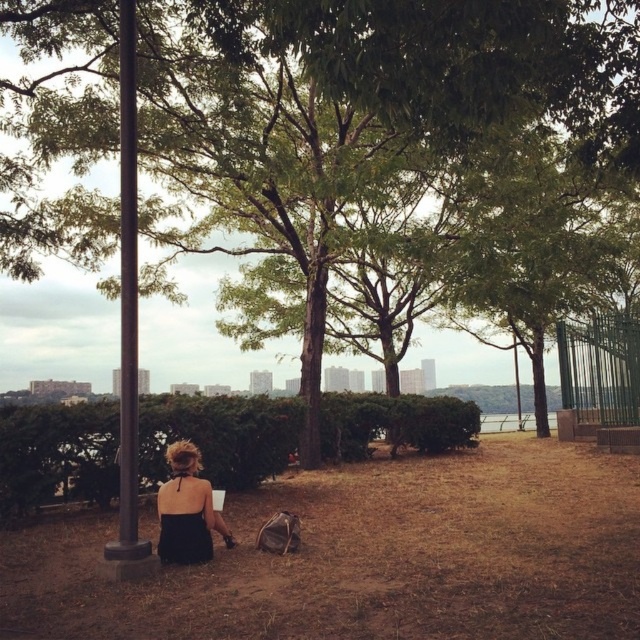
You are a photographer setting up equipment in the park. You need to position a tripod between the black metal pole at left and the black satin dress at lower left. According to the scene, where should you place the tripod?

The black metal pole at left is to the left of the black satin dress at lower left, so you should place the tripod between them, ensuring it is positioned to the right of the black metal pole at left and to the left of the black satin dress at lower left.

You are a photographer setting up equipment in the park. You notice the black metal pole at left and the black satin dress at lower left. Which object should you avoid placing your tripod near to ensure it doesn t block the view of the trees in the midground?

You should avoid placing your tripod near the black metal pole at left because it is larger in size than the black satin dress at lower left, so it is more likely to obstruct the view of the trees in the midground.

You are a photographer setting up a shot of the scene. You have a camera with a lens that can focus on objects up to 1 meter in width. You need to decide whether the black metal pole at left and the black satin dress at lower left will both fit within the frame. The frame can only accommodate objects with a combined width of 1.5 meters. What should you do?

The black metal pole at left is thinner than the black satin dress at lower left. Since the combined width must not exceed 1.5 meters, you can include both as long as their total width stays within the limit.